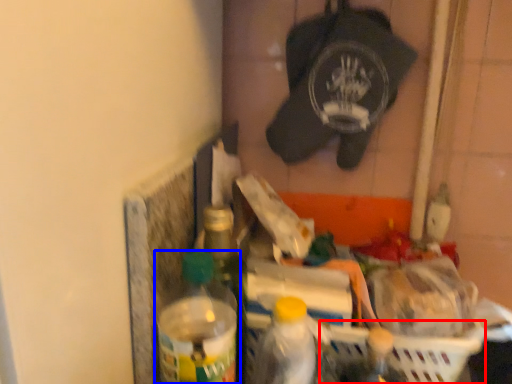
Question: Which object is closer to the camera taking this photo, basket (highlighted by a red box) or bottle (highlighted by a blue box)?

Choices:
 (A) basket
 (B) bottle

Answer: (B)